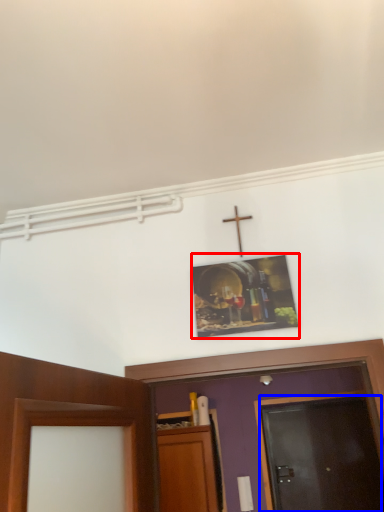
Question: Which object appears closest to the camera in this image, picture frame (highlighted by a red box) or door (highlighted by a blue box)?

Choices:
 (A) picture frame
 (B) door

Answer: (A)